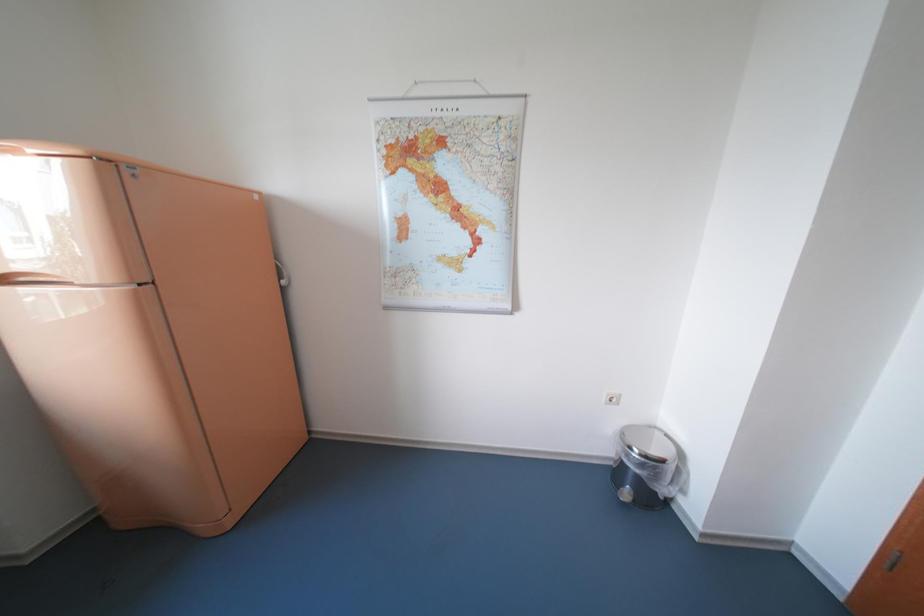
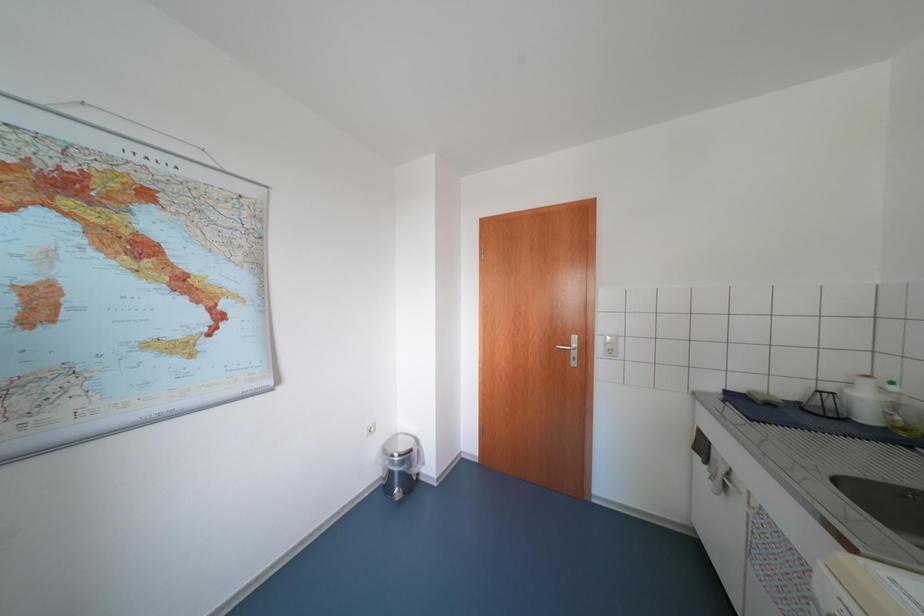
Question: The camera is either moving clockwise (left) or counter-clockwise (right) around the object. The first image is from the beginning of the video and the second image is from the end. Is the camera moving left or right when shooting the video?

Choices:
 (A) Left
 (B) Right

Answer: (A)